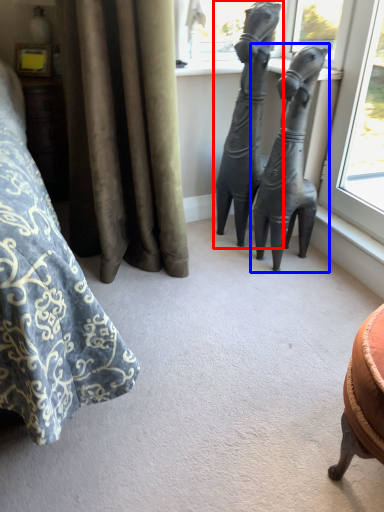
Question: Which object is closer to the camera taking this photo, statue (sculpture) (highlighted by a red box) or statue (sculpture) (highlighted by a blue box)?

Choices:
 (A) statue (sculpture)
 (B) statue (sculpture)

Answer: (B)